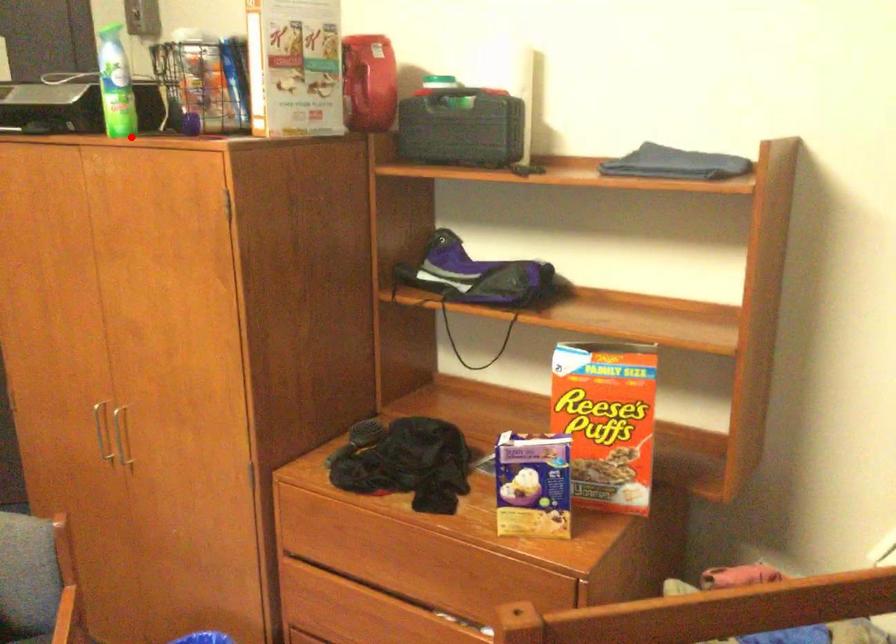
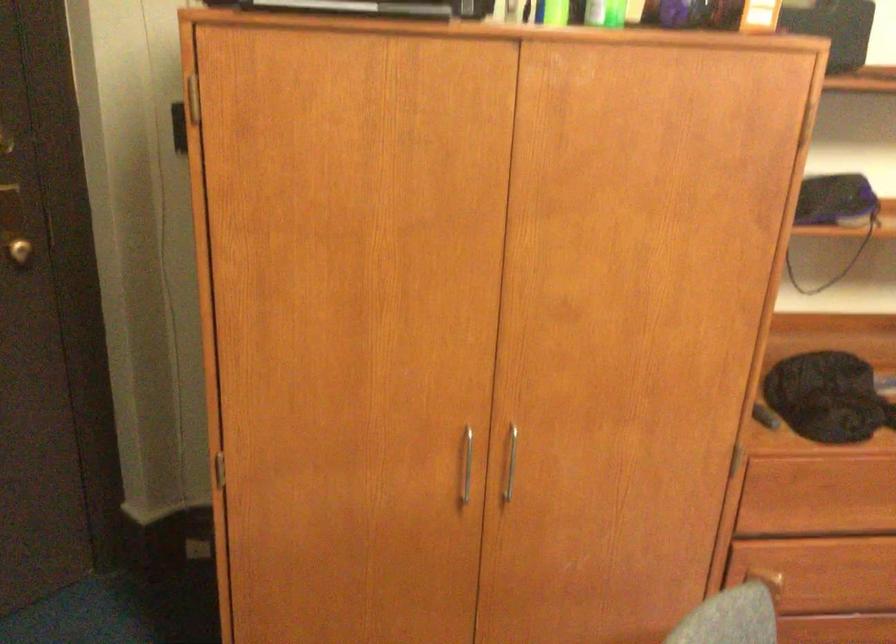
Find the pixel in the second image that matches the highlighted location in the first image.

(605, 13)